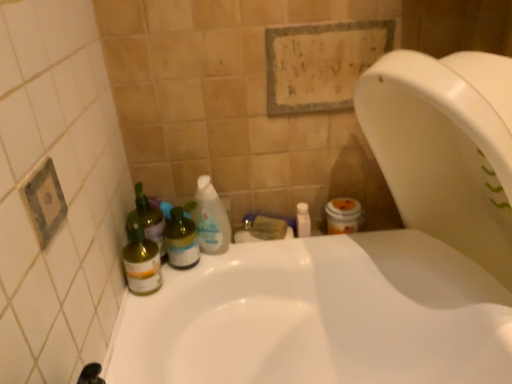
Looking at this image, measure the distance between point (x=209, y=197) and camera.

Point (x=209, y=197) is 1.02 meters from camera.

This screenshot has width=512, height=384. Describe the element at coordinates (148, 220) in the screenshot. I see `translucent plastic bottle at left, the second cleaning product in the right-to-left sequence` at that location.

What is the approximate height of white glossy bottle at upper center?

2.54 inches.

Where is `translucent plastic bottle at center, which is the first cleaning product in right-to-left order`? The height and width of the screenshot is (384, 512). translucent plastic bottle at center, which is the first cleaning product in right-to-left order is located at coordinates (211, 218).

Who is bigger, white glossy bottle at upper center or translucent plastic bottle at center, which is the first cleaning product in right-to-left order?

translucent plastic bottle at center, which is the first cleaning product in right-to-left order.

From a real-world perspective, which object rests below the other?

white glossy bottle at upper center is physically lower.

Can you confirm if white glossy bottle at upper center is wider than translucent plastic bottle at center, placed as the 2th cleaning product when sorted from left to right?

Indeed, white glossy bottle at upper center has a greater width compared to translucent plastic bottle at center, placed as the 2th cleaning product when sorted from left to right.

Is translucent plastic bottle at left, the second cleaning product in the right-to-left sequence, not near translucent plastic bottle at center, placed as the 2th cleaning product when sorted from left to right?

No.

Can you confirm if translucent plastic bottle at left, which is the first cleaning product from left to right, is shorter than translucent plastic bottle at center, which is the first cleaning product in right-to-left order?

Correct, translucent plastic bottle at left, which is the first cleaning product from left to right, is not as tall as translucent plastic bottle at center, which is the first cleaning product in right-to-left order.

From a real-world perspective, is translucent plastic bottle at left, which is the first cleaning product from left to right, above or below translucent plastic bottle at center, which is the first cleaning product in right-to-left order?

translucent plastic bottle at left, which is the first cleaning product from left to right, is situated lower than translucent plastic bottle at center, which is the first cleaning product in right-to-left order, in the real world.

Is translucent plastic bottle at left, which is the first cleaning product from left to right, turned away from translucent plastic bottle at center, placed as the 2th cleaning product when sorted from left to right?

That's not correct — translucent plastic bottle at left, which is the first cleaning product from left to right, is not looking away from translucent plastic bottle at center, placed as the 2th cleaning product when sorted from left to right.

Is green glass bottle at left, positioned as the first bottle in right-to-left order, inside the boundaries of translucent green bottle at left, the first bottle positioned from the left, or outside?

green glass bottle at left, positioned as the first bottle in right-to-left order, is located beyond the bounds of translucent green bottle at left, the first bottle positioned from the left.

This screenshot has width=512, height=384. I want to click on bottle behind the translucent green bottle at left, the first bottle positioned from the left, so click(181, 240).

Does green glass bottle at left, arranged as the second bottle when viewed from the left, turn towards translucent green bottle at left, positioned as the 2th bottle in right-to-left order?

No, green glass bottle at left, arranged as the second bottle when viewed from the left, is not oriented towards translucent green bottle at left, positioned as the 2th bottle in right-to-left order.

What's the angular difference between translucent green bottle at left, positioned as the 2th bottle in right-to-left order, and translucent plastic bottle at center, which is the first cleaning product in right-to-left order,'s facing directions?

There is a 18-degree angle between the facing directions of translucent green bottle at left, positioned as the 2th bottle in right-to-left order, and translucent plastic bottle at center, which is the first cleaning product in right-to-left order.

Who is more distant, translucent green bottle at left, the first bottle positioned from the left, or translucent plastic bottle at center, which is the first cleaning product in right-to-left order?

Positioned behind is translucent plastic bottle at center, which is the first cleaning product in right-to-left order.

Does translucent green bottle at left, the first bottle positioned from the left, touch translucent plastic bottle at center, which is the first cleaning product in right-to-left order?

No, translucent green bottle at left, the first bottle positioned from the left, is not beside translucent plastic bottle at center, which is the first cleaning product in right-to-left order.

Considering the sizes of translucent green bottle at left, the first bottle positioned from the left, and translucent plastic bottle at center, placed as the 2th cleaning product when sorted from left to right, in the image, is translucent green bottle at left, the first bottle positioned from the left, taller or shorter than translucent plastic bottle at center, placed as the 2th cleaning product when sorted from left to right,?

translucent green bottle at left, the first bottle positioned from the left, is shorter than translucent plastic bottle at center, placed as the 2th cleaning product when sorted from left to right.

Which of these two, white glossy bottle at upper center or translucent green bottle at left, the first bottle positioned from the left, is wider?

translucent green bottle at left, the first bottle positioned from the left.

Is white glossy bottle at upper center oriented away from translucent green bottle at left, positioned as the 2th bottle in right-to-left order?

No, white glossy bottle at upper center is not facing the opposite direction of translucent green bottle at left, positioned as the 2th bottle in right-to-left order.

Does point (300, 222) come farther from viewer compared to point (157, 268)?

That is True.

Between white glossy bottle at upper center and translucent green bottle at left, the first bottle positioned from the left, which one has less height?

Standing shorter between the two is white glossy bottle at upper center.

Is translucent plastic bottle at left, the second cleaning product in the right-to-left sequence, at the back of translucent plastic bottle at center, placed as the 2th cleaning product when sorted from left to right?

No.

Which is correct: translucent plastic bottle at center, placed as the 2th cleaning product when sorted from left to right, is inside translucent plastic bottle at left, which is the first cleaning product from left to right, or outside of it?

translucent plastic bottle at center, placed as the 2th cleaning product when sorted from left to right, is located beyond the bounds of translucent plastic bottle at left, which is the first cleaning product from left to right.

I want to click on cleaning product located on the left of translucent plastic bottle at center, placed as the 2th cleaning product when sorted from left to right, so click(x=148, y=220).

Is point (203, 189) positioned after point (164, 246)?

Yes.

Does translucent green bottle at left, positioned as the 2th bottle in right-to-left order, have a larger size compared to translucent plastic bottle at left, which is the first cleaning product from left to right?

Actually, translucent green bottle at left, positioned as the 2th bottle in right-to-left order, might be smaller than translucent plastic bottle at left, which is the first cleaning product from left to right.

Which is behind, point (138, 254) or point (151, 224)?

The point (151, 224) is farther from the camera.

Is translucent green bottle at left, the first bottle positioned from the left, positioned with its back to translucent plastic bottle at left, the second cleaning product in the right-to-left sequence?

That's right, translucent green bottle at left, the first bottle positioned from the left, is facing away from translucent plastic bottle at left, the second cleaning product in the right-to-left sequence.

From the image's perspective, is translucent green bottle at left, the first bottle positioned from the left, positioned above or below translucent plastic bottle at left, the second cleaning product in the right-to-left sequence?

From the image's perspective, translucent green bottle at left, the first bottle positioned from the left, appears below translucent plastic bottle at left, the second cleaning product in the right-to-left sequence.

Image resolution: width=512 pixels, height=384 pixels. I want to click on mouthwash that appears on the right of translucent plastic bottle at center, placed as the 2th cleaning product when sorted from left to right, so click(303, 220).

Image resolution: width=512 pixels, height=384 pixels. What are the coordinates of `cleaning product behind the translucent plastic bottle at left, which is the first cleaning product from left to right` in the screenshot? It's located at (211, 218).

Looking at the image, which one is located further to green glass bottle at left, positioned as the first bottle in right-to-left order, white glossy bottle at upper center or translucent plastic bottle at center, which is the first cleaning product in right-to-left order?

Among the two, white glossy bottle at upper center is located further to green glass bottle at left, positioned as the first bottle in right-to-left order.

Based on their spatial positions, is translucent plastic bottle at center, placed as the 2th cleaning product when sorted from left to right, or green glass bottle at left, arranged as the second bottle when viewed from the left, further from translucent green bottle at left, the first bottle positioned from the left?

translucent plastic bottle at center, placed as the 2th cleaning product when sorted from left to right, is further to translucent green bottle at left, the first bottle positioned from the left.

Based on their spatial positions, is white glossy bottle at upper center or translucent plastic bottle at left, the second cleaning product in the right-to-left sequence, further from translucent green bottle at left, the first bottle positioned from the left?

Based on the image, white glossy bottle at upper center appears to be further to translucent green bottle at left, the first bottle positioned from the left.

Considering their positions, is translucent plastic bottle at center, placed as the 2th cleaning product when sorted from left to right, positioned further to translucent plastic bottle at left, which is the first cleaning product from left to right, than white glossy bottle at upper center?

The object further to translucent plastic bottle at left, which is the first cleaning product from left to right, is white glossy bottle at upper center.

From the image, which object appears to be farther from translucent plastic bottle at left, the second cleaning product in the right-to-left sequence, translucent green bottle at left, the first bottle positioned from the left, or green glass bottle at left, arranged as the second bottle when viewed from the left?

Among the two, green glass bottle at left, arranged as the second bottle when viewed from the left, is located further to translucent plastic bottle at left, the second cleaning product in the right-to-left sequence.

Estimate the real-world distances between objects in this image. Which object is further from green glass bottle at left, positioned as the first bottle in right-to-left order, white glossy bottle at upper center or translucent green bottle at left, the first bottle positioned from the left?

white glossy bottle at upper center is positioned further to the anchor green glass bottle at left, positioned as the first bottle in right-to-left order.

When comparing their distances from green glass bottle at left, positioned as the first bottle in right-to-left order, does translucent plastic bottle at center, which is the first cleaning product in right-to-left order, or translucent green bottle at left, the first bottle positioned from the left, seem further?

translucent green bottle at left, the first bottle positioned from the left, is positioned further to the anchor green glass bottle at left, positioned as the first bottle in right-to-left order.

Considering their positions, is translucent plastic bottle at center, which is the first cleaning product in right-to-left order, positioned closer to green glass bottle at left, positioned as the first bottle in right-to-left order, than white glossy bottle at upper center?

Among the two, translucent plastic bottle at center, which is the first cleaning product in right-to-left order, is located nearer to green glass bottle at left, positioned as the first bottle in right-to-left order.

Locate an element on the screen. This screenshot has width=512, height=384. cleaning product situated between green glass bottle at left, arranged as the second bottle when viewed from the left, and white glossy bottle at upper center from left to right is located at coordinates (211, 218).

What are the coordinates of `bottle between translucent green bottle at left, the first bottle positioned from the left, and translucent plastic bottle at left, which is the first cleaning product from left to right, along the z-axis` in the screenshot? It's located at [x=181, y=240].

The width and height of the screenshot is (512, 384). I want to click on cleaning product located between translucent plastic bottle at left, the second cleaning product in the right-to-left sequence, and white glossy bottle at upper center in the left-right direction, so click(x=211, y=218).

Where is `bottle between translucent green bottle at left, positioned as the 2th bottle in right-to-left order, and translucent plastic bottle at center, which is the first cleaning product in right-to-left order`? This screenshot has height=384, width=512. bottle between translucent green bottle at left, positioned as the 2th bottle in right-to-left order, and translucent plastic bottle at center, which is the first cleaning product in right-to-left order is located at coordinates (181, 240).